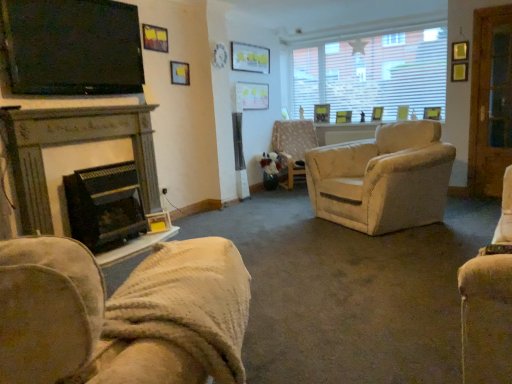
Question: Would you say dark gray stone fireplace at left, marked as the first fireplace in a top-to-bottom arrangement, is to the left or to the right of beige fabric chair at center, the 1th chair positioned from the right, in the picture?

Choices:
 (A) left
 (B) right

Answer: (A)

Question: Do you think dark gray stone fireplace at left, marked as the first fireplace in a top-to-bottom arrangement, is within beige fabric chair at center, which is counted as the 1th chair, starting from the top, or outside of it?

Choices:
 (A) inside
 (B) outside

Answer: (B)

Question: Based on their relative distances, which object is farther from the matte black tv at upper left?

Choices:
 (A) velvet beige armchair at lower left, the second chair in the right-to-left sequence
 (B) white textured window at upper right
 (C) wooden screen door at right
 (D) black matte fireplace at left, which ranks as the first fireplace in bottom-to-top order
 (E) matte white picture frame at upper center

Answer: (C)

Question: Which of these objects is positioned farthest from the matte black tv at upper left?

Choices:
 (A) black matte fireplace at left, which is counted as the 2th fireplace, starting from the top
 (B) dark gray stone fireplace at left, which appears as the second fireplace when ordered from the bottom
 (C) matte white picture frame at upper center
 (D) velvet beige armchair at lower left, which is counted as the first chair, starting from the bottom
 (E) white textured window at upper right

Answer: (E)